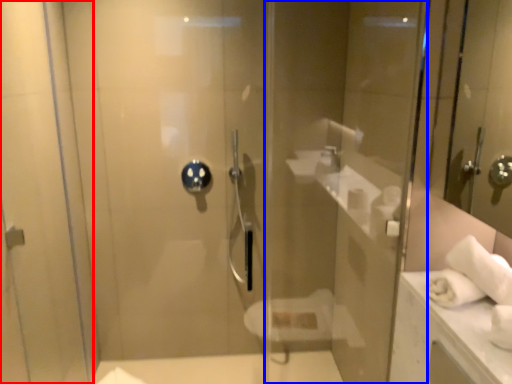
Question: Which object is closer to the camera taking this photo, screen door (highlighted by a red box) or glass door (highlighted by a blue box)?

Choices:
 (A) screen door
 (B) glass door

Answer: (A)